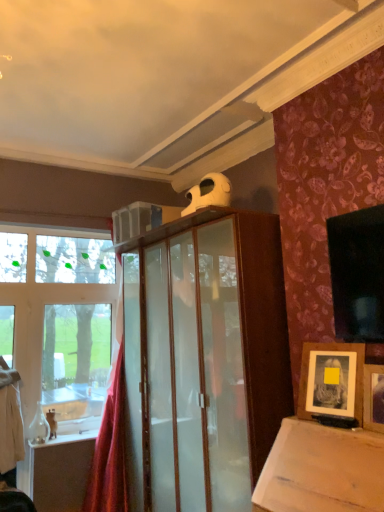
Question: From a real-world perspective, is red velvet curtain at left positioned over wooden framed photo at lower right, the first picture frame viewed from the back, based on gravity?

Choices:
 (A) yes
 (B) no

Answer: (B)

Question: From the image's perspective, is red velvet curtain at left located beneath wooden framed photo at lower right, the first picture frame viewed from the back?

Choices:
 (A) yes
 (B) no

Answer: (A)

Question: Considering the relative sizes of red velvet curtain at left and wooden framed photo at lower right, the 2th picture frame when ordered from front to back, in the image provided, is red velvet curtain at left shorter than wooden framed photo at lower right, the 2th picture frame when ordered from front to back,?

Choices:
 (A) no
 (B) yes

Answer: (A)

Question: From a real-world perspective, is red velvet curtain at left positioned under wooden framed photo at lower right, the first picture frame viewed from the back, based on gravity?

Choices:
 (A) no
 (B) yes

Answer: (B)

Question: Is the depth of red velvet curtain at left greater than that of wooden framed photo at lower right, the 2th picture frame when ordered from front to back?

Choices:
 (A) yes
 (B) no

Answer: (A)

Question: Is red velvet curtain at left with wooden framed photo at lower right, the first picture frame viewed from the back?

Choices:
 (A) no
 (B) yes

Answer: (A)

Question: Considering the relative sizes of wooden picture frame at upper right, which ranks as the first picture frame in front-to-back order, and red velvet curtain at left in the image provided, is wooden picture frame at upper right, which ranks as the first picture frame in front-to-back order, taller than red velvet curtain at left?

Choices:
 (A) yes
 (B) no

Answer: (B)

Question: Would you say red velvet curtain at left is part of wooden picture frame at upper right, placed as the second picture frame when sorted from back to front,'s contents?

Choices:
 (A) yes
 (B) no

Answer: (B)

Question: Considering the relative sizes of wooden picture frame at upper right, which ranks as the first picture frame in front-to-back order, and red velvet curtain at left in the image provided, is wooden picture frame at upper right, which ranks as the first picture frame in front-to-back order, shorter than red velvet curtain at left?

Choices:
 (A) no
 (B) yes

Answer: (B)

Question: Is wooden picture frame at upper right, which ranks as the first picture frame in front-to-back order, at the right side of red velvet curtain at left?

Choices:
 (A) yes
 (B) no

Answer: (A)

Question: Is wooden picture frame at upper right, placed as the second picture frame when sorted from back to front, not within red velvet curtain at left?

Choices:
 (A) no
 (B) yes

Answer: (B)

Question: Does wooden picture frame at upper right, placed as the second picture frame when sorted from back to front, lie behind red velvet curtain at left?

Choices:
 (A) yes
 (B) no

Answer: (B)

Question: From the image's perspective, is wooden framed photo at lower right, the 2th picture frame when ordered from front to back, over red velvet curtain at left?

Choices:
 (A) no
 (B) yes

Answer: (B)